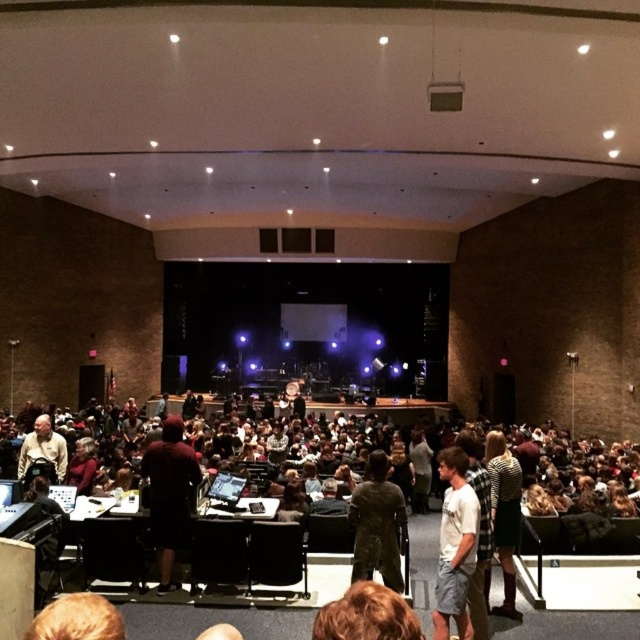
Question: Among these objects, which one is nearest to the camera?

Choices:
 (A) light brown leather jacket at lower left
 (B) white cotton t-shirt at center

Answer: (B)

Question: Is white cotton t-shirt at center above light brown leather jacket at lower left?

Choices:
 (A) yes
 (B) no

Answer: (B)

Question: Which point is closer to the camera?

Choices:
 (A) (20, 451)
 (B) (449, 540)

Answer: (B)

Question: Is white cotton t-shirt at center bigger than light brown leather jacket at lower left?

Choices:
 (A) yes
 (B) no

Answer: (B)

Question: In this image, where is white cotton t-shirt at center located relative to light brown leather jacket at lower left?

Choices:
 (A) left
 (B) right

Answer: (B)

Question: Which point is closer to the camera taking this photo?

Choices:
 (A) (458, 493)
 (B) (54, 472)

Answer: (A)